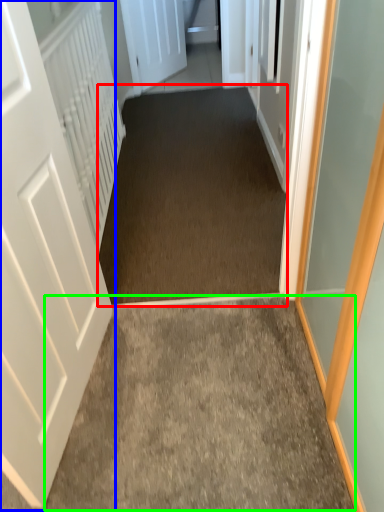
Question: Which is farther away from corridor (highlighted by a red box)? door (highlighted by a blue box) or path (highlighted by a green box)?

Choices:
 (A) door
 (B) path

Answer: (A)